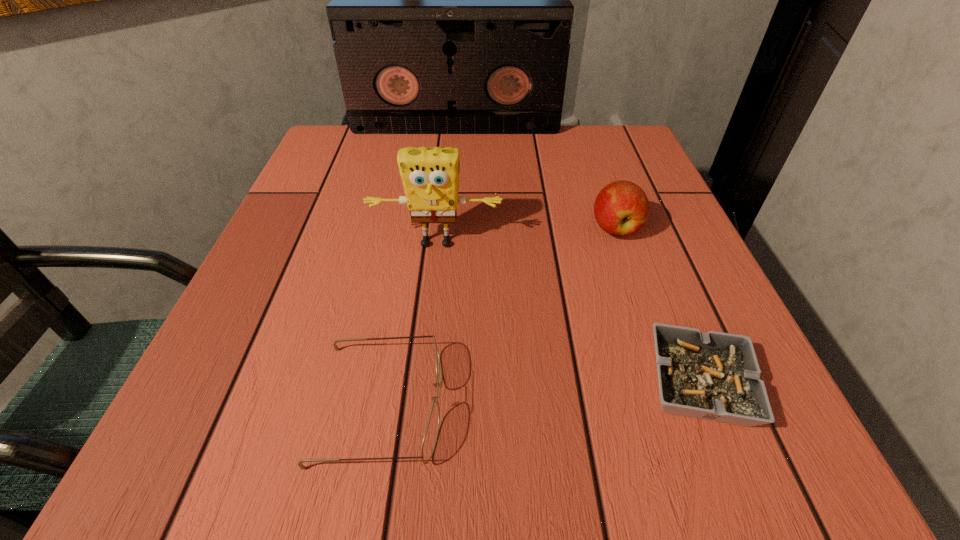
You are a GUI agent. You are given a task and a screenshot of the screen. Output one action in this format:
    pyautogui.click(x=<x>, y=<y>)
    Task: Click on the tallest object
    The image size is (960, 540).
    Given the screenshot: What is the action you would take?
    pyautogui.click(x=451, y=13)

Identify the location of videotape. This screenshot has height=540, width=960. pos(451,13).

I want to click on the fourth shortest object, so click(x=430, y=176).

Find the location of a particular element. apple is located at coordinates (621, 208).

This screenshot has width=960, height=540. In order to click on spectacles in this screenshot , I will do `click(429, 442)`.

The height and width of the screenshot is (540, 960). Find the location of `ashtray`. ashtray is located at coordinates (715, 376).

Image resolution: width=960 pixels, height=540 pixels. Find the location of `vacant region located on the front side of the farthest object`. vacant region located on the front side of the farthest object is located at coordinates (454, 146).

This screenshot has width=960, height=540. In order to click on free space located on the face of the sponge in this screenshot , I will do `click(428, 313)`.

Where is `vacant area situated on the front of the apple`? The height and width of the screenshot is (540, 960). vacant area situated on the front of the apple is located at coordinates (668, 381).

Locate an element on the screen. blank space located 0.150m on the front-facing side of the spectacles is located at coordinates (558, 404).